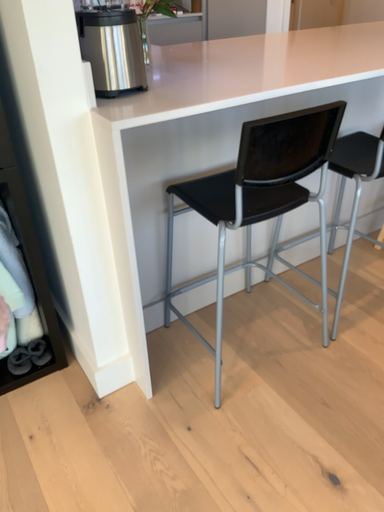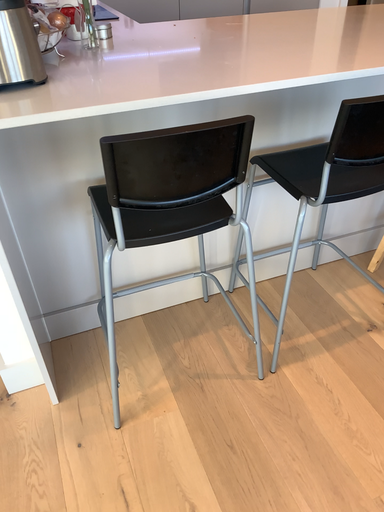
Question: Which way did the camera rotate in the video?

Choices:
 (A) rotated left
 (B) rotated right

Answer: (A)